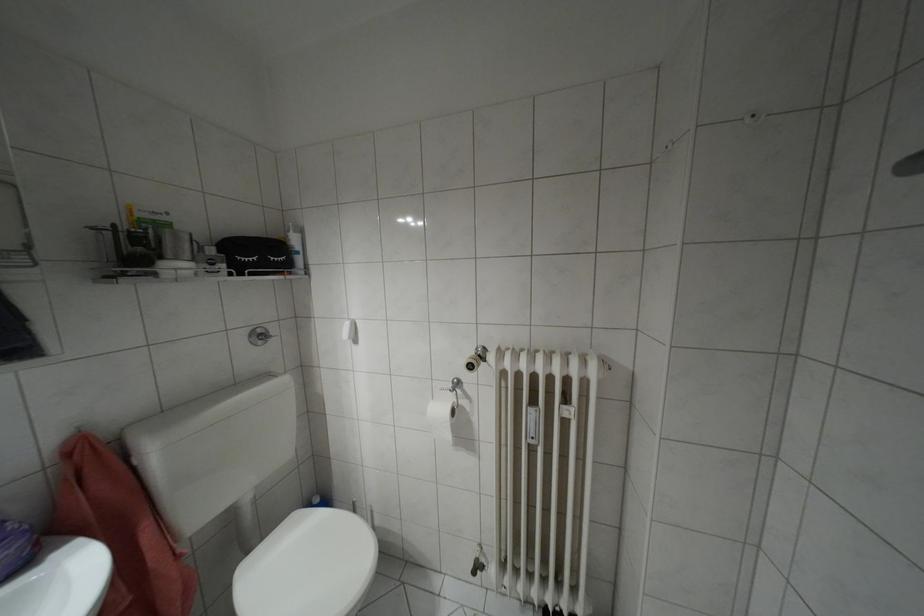
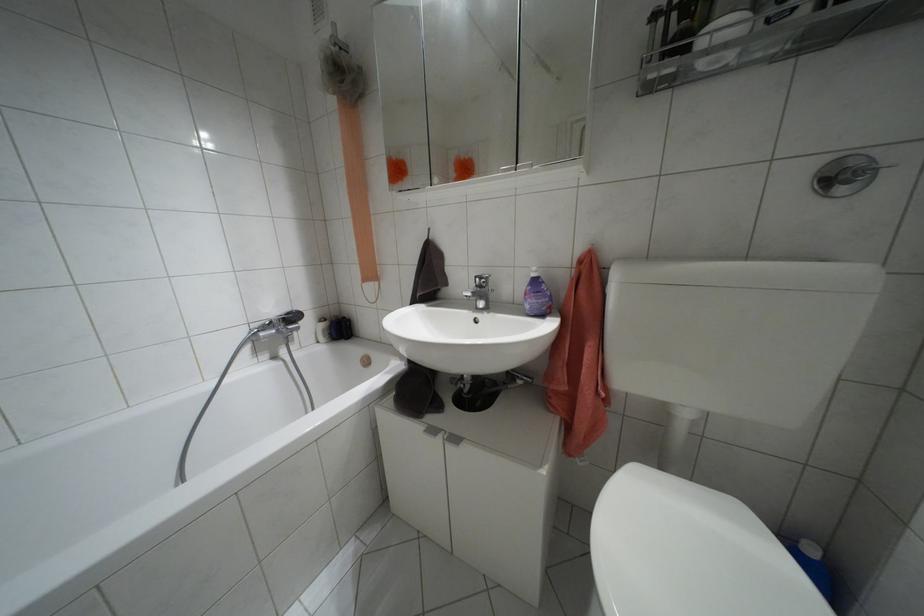
The first image is from the beginning of the video and the second image is from the end. How did the camera likely rotate when shooting the video?

The camera's rotation is toward left-down.